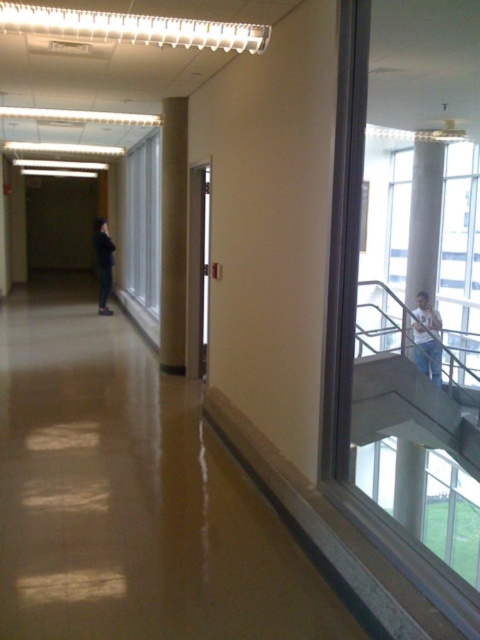
You are navigating a hallway and need to locate the white cotton shirt at upper right. According to the scene description, where would you find it?

The white cotton shirt at upper right is located at the 2D coordinates point (427, 339) in the scene.

You are an interior designer assessing the hallway layout. You notice the white cotton shirt at upper right and the black matte jacket at left. Which object occupies more visual space in the scene?

The white cotton shirt at upper right occupies more visual space than the black matte jacket at left because it is described as bigger.